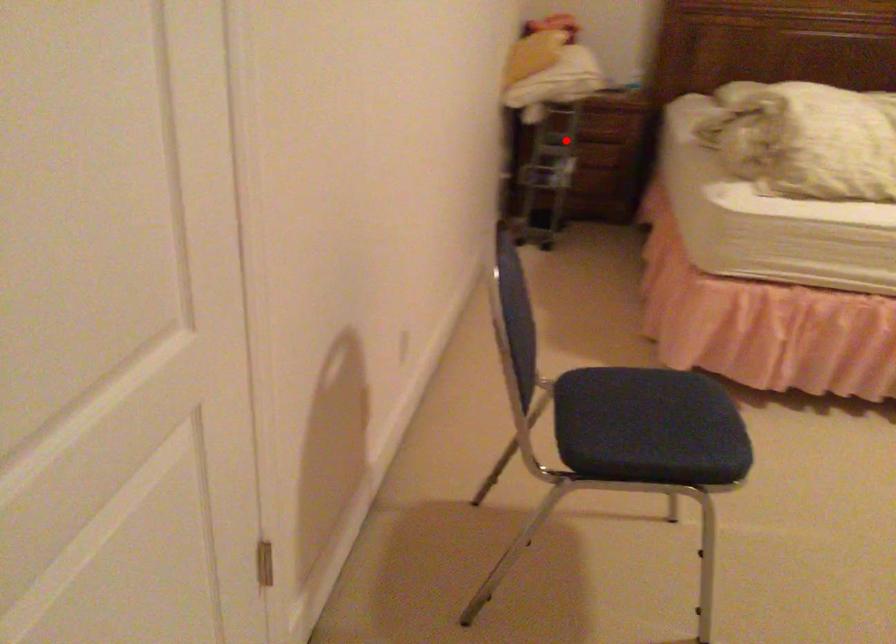
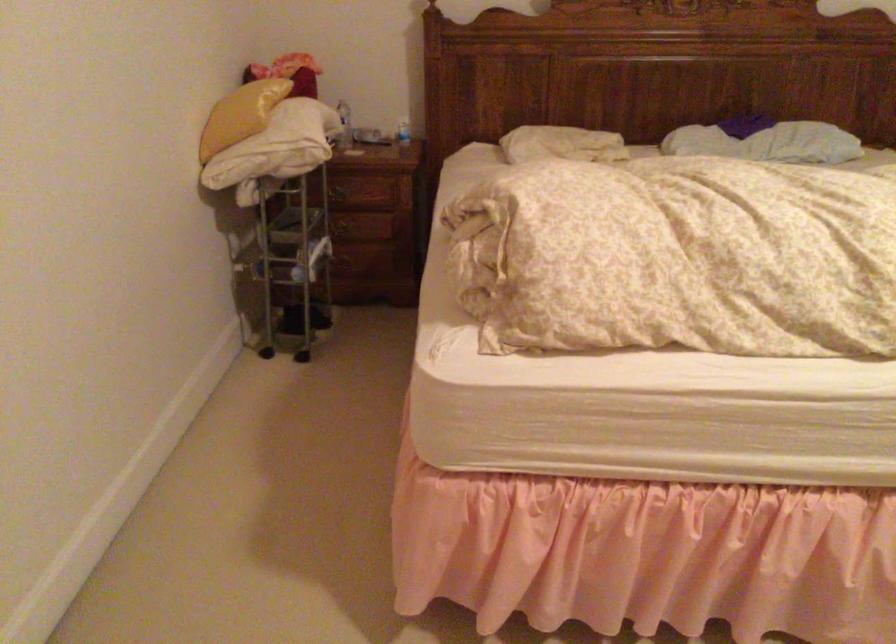
In the second image, find the point that corresponds to the highlighted location in the first image.

(342, 230)